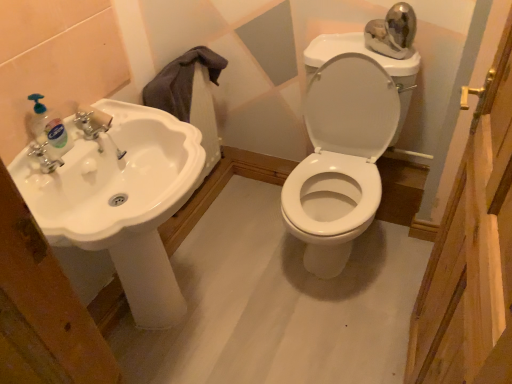
You are a GUI agent. You are given a task and a screenshot of the screen. Output one action in this format:
    pyautogui.click(x=<x>, y=<y>)
    Task: Click on the free spot to the right of translucent plastic soap dispenser at left
    
    Given the screenshot: What is the action you would take?
    pyautogui.click(x=96, y=142)